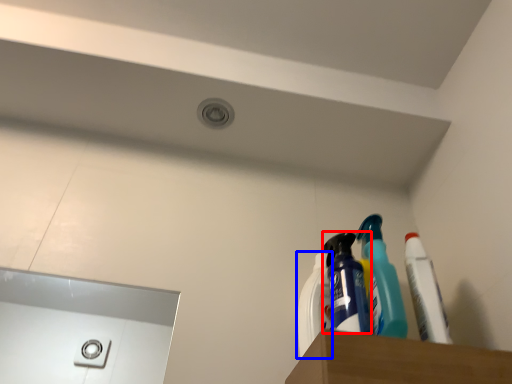
Question: Among these objects, which one is farthest to the camera, cleaning product (highlighted by a red box) or cleaning product (highlighted by a blue box)?

Choices:
 (A) cleaning product
 (B) cleaning product

Answer: (B)